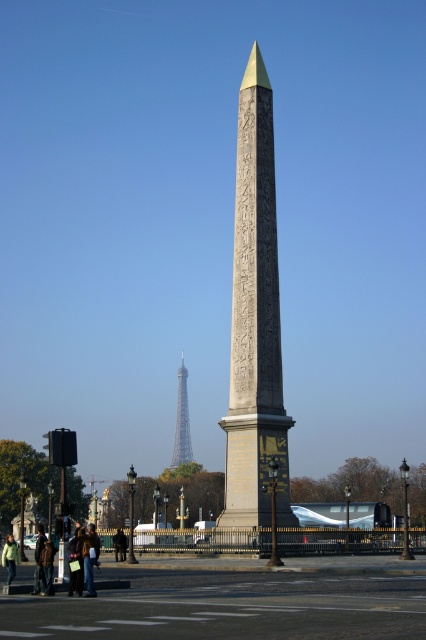
Can you confirm if metallic gold tower at center is positioned above green fabric jacket at lower left?

Indeed, metallic gold tower at center is positioned over green fabric jacket at lower left.

Is point (187, 394) closer to viewer compared to point (14, 560)?

No.

Identify the location of metallic gold tower at center. (181, 422).

Can you confirm if metallic gold eiffel tower at center is taller than metallic gold tower at center?

Yes.

Between metallic gold eiffel tower at center and metallic gold tower at center, which one has less height?

With less height is metallic gold tower at center.

This screenshot has width=426, height=640. Describe the element at coordinates (255, 321) in the screenshot. I see `metallic gold eiffel tower at center` at that location.

This screenshot has width=426, height=640. I want to click on metallic gold eiffel tower at center, so click(x=255, y=321).

Between point (253, 285) and point (14, 557), which one is positioned behind?

Positioned behind is point (253, 285).

Is metallic gold eiffel tower at center closer to camera compared to green fabric jacket at lower left?

That is False.

Between point (281, 408) and point (14, 548), which one is positioned in front?

Point (14, 548) is more forward.

Image resolution: width=426 pixels, height=640 pixels. In order to click on metallic gold eiffel tower at center in this screenshot , I will do coord(255,321).